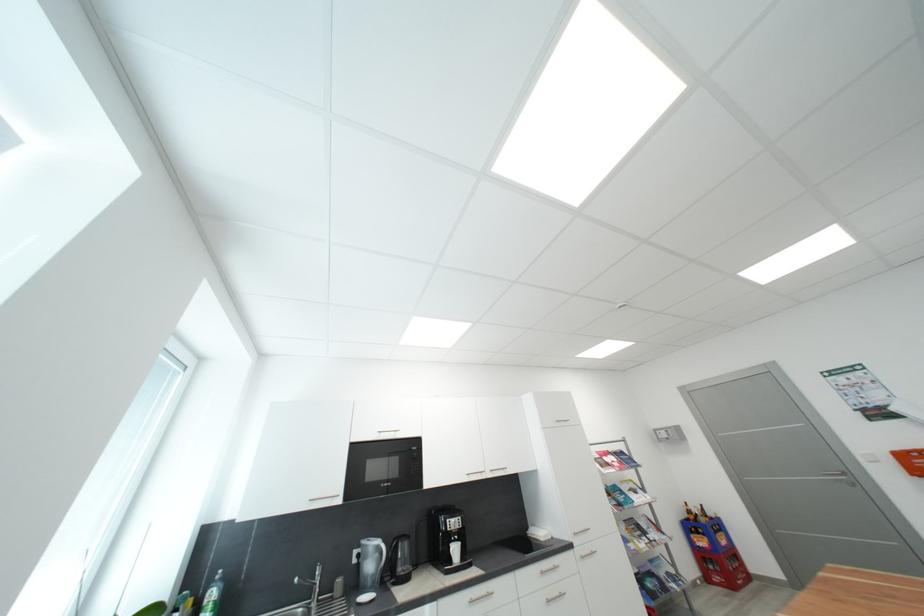
The image size is (924, 616). I want to click on sink faucet handle, so click(311, 584).